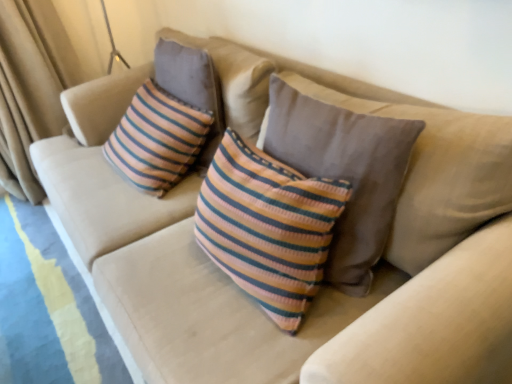
What do you see at coordinates (345, 172) in the screenshot? I see `knitted striped pillow at center` at bounding box center [345, 172].

You are a GUI agent. You are given a task and a screenshot of the screen. Output one action in this format:
    pyautogui.click(x=<x>, y=<y>)
    Task: Click on the knitted striped pillow at center
    The height and width of the screenshot is (384, 512).
    Given the screenshot: What is the action you would take?
    pyautogui.click(x=345, y=172)

What is the approximate width of beige fabric curtain at left?

The width of beige fabric curtain at left is 14.65 inches.

Image resolution: width=512 pixels, height=384 pixels. Describe the element at coordinates (31, 88) in the screenshot. I see `beige fabric curtain at left` at that location.

This screenshot has width=512, height=384. What are the coordinates of `beige fabric curtain at left` in the screenshot? It's located at point(31,88).

Image resolution: width=512 pixels, height=384 pixels. What are the coordinates of `knitted striped pillow at center` in the screenshot? It's located at pyautogui.click(x=345, y=172).

Is knitted striped pillow at center at the right side of beige fabric curtain at left?

Indeed, knitted striped pillow at center is positioned on the right side of beige fabric curtain at left.

Considering the relative positions of knitted striped pillow at center and beige fabric curtain at left in the image provided, is knitted striped pillow at center behind beige fabric curtain at left?

No, it is in front of beige fabric curtain at left.

Is point (325, 103) positioned before point (52, 77)?

Yes, point (325, 103) is in front of point (52, 77).

From the image's perspective, is knitted striped pillow at center above or below beige fabric curtain at left?

Clearly, from the image's perspective, knitted striped pillow at center is below beige fabric curtain at left.

From a real-world perspective, is knitted striped pillow at center located higher than beige fabric curtain at left?

Correct, in the physical world, knitted striped pillow at center is higher than beige fabric curtain at left.

Considering the sizes of objects knitted striped pillow at center and beige fabric curtain at left in the image provided, who is wider, knitted striped pillow at center or beige fabric curtain at left?

beige fabric curtain at left is wider.

Who is shorter, knitted striped pillow at center or beige fabric curtain at left?

Standing shorter between the two is knitted striped pillow at center.

Is knitted striped pillow at center bigger or smaller than beige fabric curtain at left?

Considering their sizes, knitted striped pillow at center takes up less space than beige fabric curtain at left.

Is knitted striped pillow at center not inside beige fabric curtain at left?

Indeed, knitted striped pillow at center is completely outside beige fabric curtain at left.

Is knitted striped pillow at center touching beige fabric curtain at left?

No.

Is knitted striped pillow at center oriented towards beige fabric curtain at left?

No, knitted striped pillow at center is not turned towards beige fabric curtain at left.

How different are the orientations of knitted striped pillow at center and beige fabric curtain at left in degrees?

89 degrees separate the facing orientations of knitted striped pillow at center and beige fabric curtain at left.

How far apart are knitted striped pillow at center and beige fabric curtain at left?

knitted striped pillow at center and beige fabric curtain at left are 1.63 meters apart.

Find the location of a particular element. The height and width of the screenshot is (384, 512). curtain behind the knitted striped pillow at center is located at coordinates (31, 88).

Is beige fabric curtain at left to the left of knitted striped pillow at center from the viewer's perspective?

Indeed, beige fabric curtain at left is positioned on the left side of knitted striped pillow at center.

Is beige fabric curtain at left in front of or behind knitted striped pillow at center in the image?

Clearly, beige fabric curtain at left is behind knitted striped pillow at center.

Which is behind, point (64, 88) or point (378, 237)?

The point (64, 88) is farther from the camera.

From the image's perspective, is beige fabric curtain at left beneath knitted striped pillow at center?

No, from the image's perspective, beige fabric curtain at left is not beneath knitted striped pillow at center.

In the scene shown: From a real-world perspective, is beige fabric curtain at left above or below knitted striped pillow at center?

In terms of real-world spatial position, beige fabric curtain at left is below knitted striped pillow at center.

Which of these two, beige fabric curtain at left or knitted striped pillow at center, is thinner?

knitted striped pillow at center is thinner.

Considering the sizes of beige fabric curtain at left and knitted striped pillow at center in the image, is beige fabric curtain at left taller or shorter than knitted striped pillow at center?

Clearly, beige fabric curtain at left is taller compared to knitted striped pillow at center.

Considering the relative sizes of beige fabric curtain at left and knitted striped pillow at center in the image provided, is beige fabric curtain at left smaller than knitted striped pillow at center?

Incorrect, beige fabric curtain at left is not smaller in size than knitted striped pillow at center.

Would you say knitted striped pillow at center is part of beige fabric curtain at left's contents?

No, knitted striped pillow at center is not surrounded by beige fabric curtain at left.

Is beige fabric curtain at left next to knitted striped pillow at center?

beige fabric curtain at left and knitted striped pillow at center are not in contact.

Is knitted striped pillow at center at the back of beige fabric curtain at left?

beige fabric curtain at left is not turned away from knitted striped pillow at center.

How many degrees apart are the facing directions of beige fabric curtain at left and knitted striped pillow at center?

The angular difference between beige fabric curtain at left and knitted striped pillow at center is 89 degrees.

Measure the distance between beige fabric curtain at left and knitted striped pillow at center.

5.35 feet.

At what (x,y) coordinates should I click in order to perform the action: click on curtain behind the knitted striped pillow at center. Please return your answer as a coordinate pair (x, y). Looking at the image, I should click on (31, 88).

What are the coordinates of `curtain behind the knitted striped pillow at center` in the screenshot? It's located at (31, 88).

Identify the location of pillow on the right of beige fabric curtain at left. This screenshot has width=512, height=384. (345, 172).